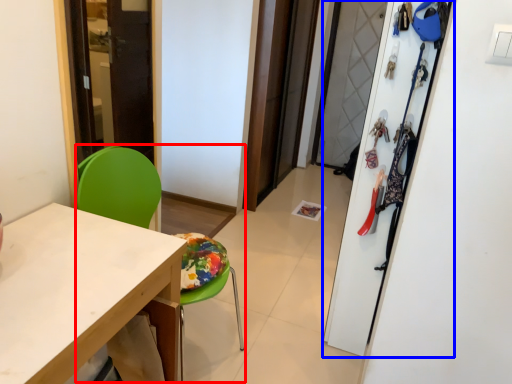
Question: Which object is closer to the camera taking this photo, armchair (highlighted by a red box) or closet (highlighted by a blue box)?

Choices:
 (A) armchair
 (B) closet

Answer: (A)